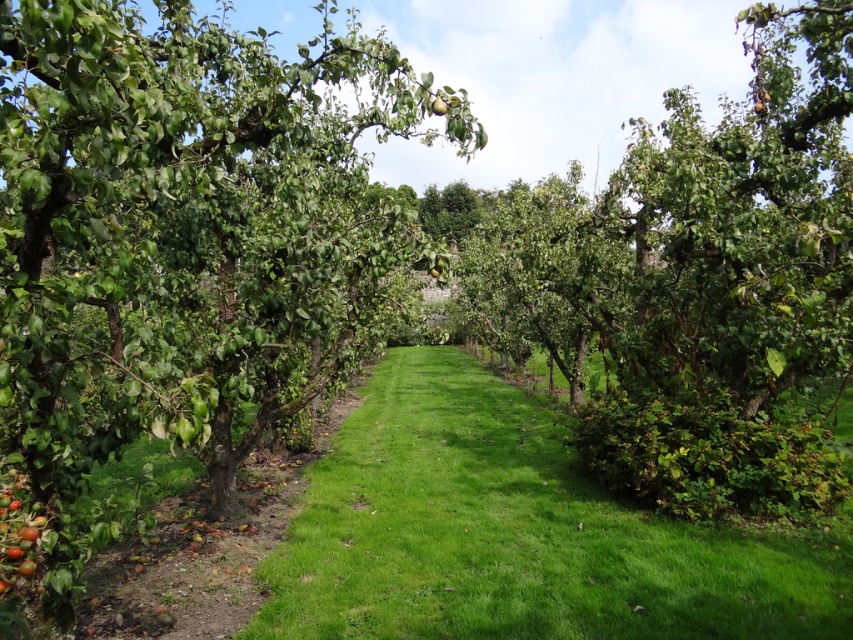
You are an apple picker standing on the grass path in the orchard. You see the green leafy tree at center and the green matte apple at center. Which object is larger in size?

The green leafy tree at center is bigger than the green matte apple at center, so the green leafy tree at center is larger in size.

You are a gardener standing at the entrance of the orchard. You see the green leafy tree at center and the ripe red apples at lower left. Which object is positioned to the right of the other?

The green leafy tree at center is to the right of the ripe red apples at lower left.

You are standing at the entrance of the orchard and want to walk to the green grass at center. According to the coordinates provided, what are the exact coordinates where you should head towards?

The green grass at center is located at coordinates point (518,532), so you should head towards that exact point.